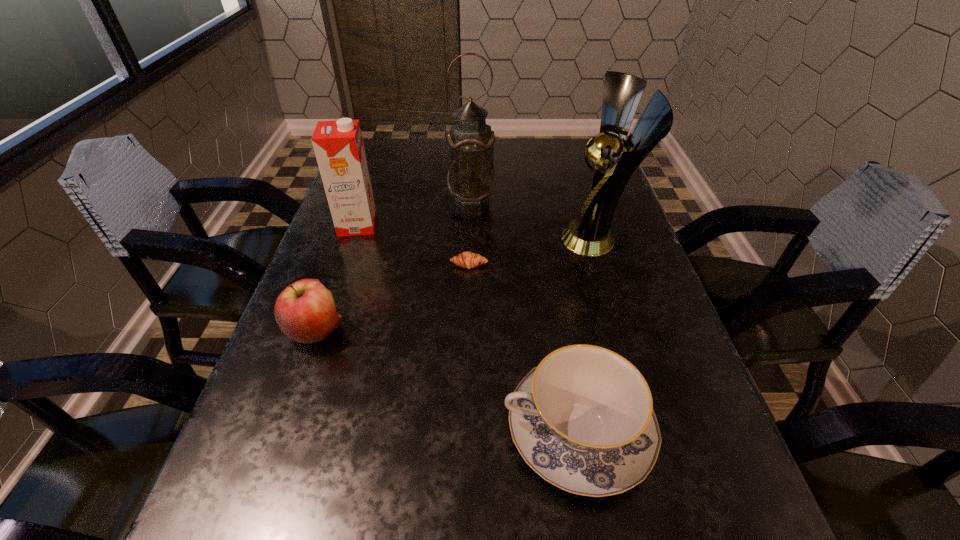
I want to click on vacant region that satisfies the following two spatial constraints: 1. at the front of the award, where the globe is visible; 2. on the front-facing side of the pastry, so click(606, 265).

Identify the location of free space that satisfies the following two spatial constraints: 1. on the front side of the third tallest object; 2. with the handle on the side of the nearest object. This screenshot has width=960, height=540. point(287,430).